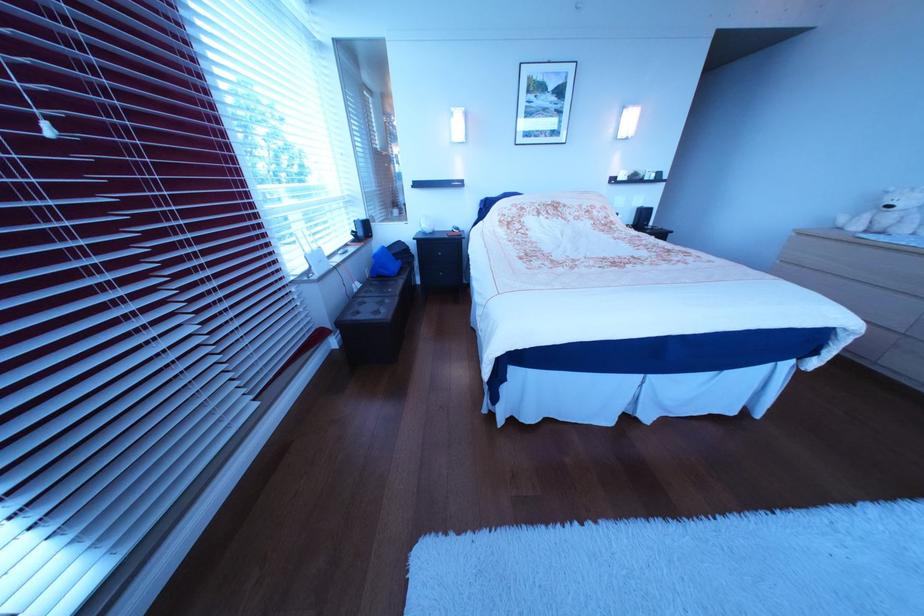
This screenshot has height=616, width=924. I want to click on nightstand drawer handle, so click(x=444, y=252).